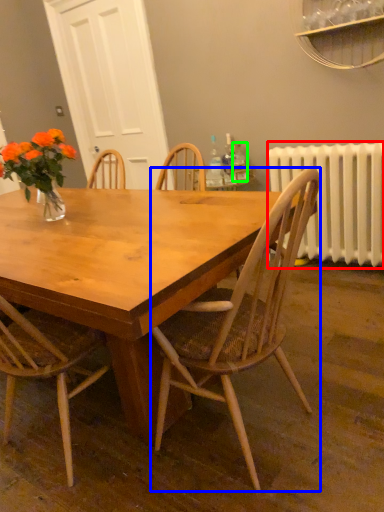
Question: Based on their relative distances, which object is farther from radiator (highlighted by a red box)? Choose from chair (highlighted by a blue box) and bottle (highlighted by a green box).

Choices:
 (A) chair
 (B) bottle

Answer: (A)